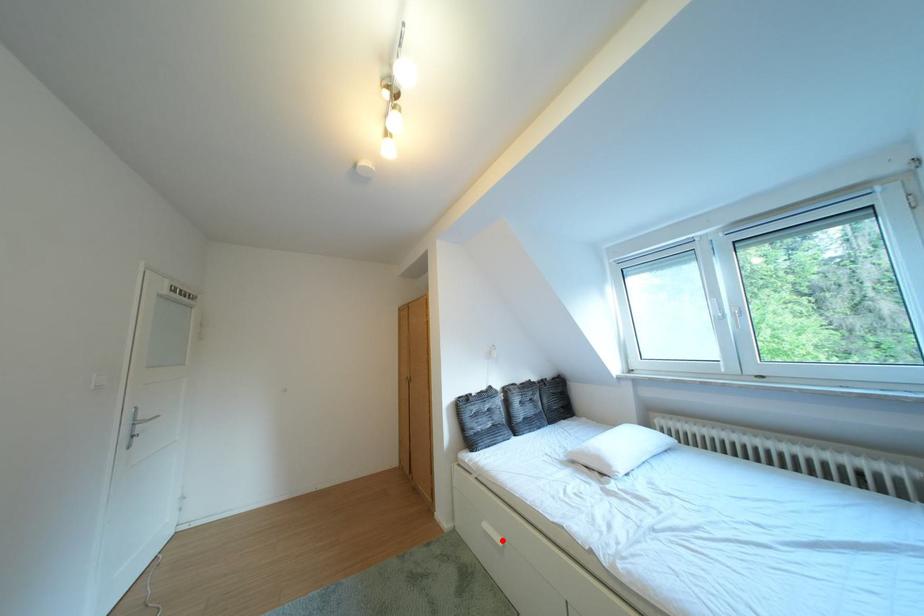
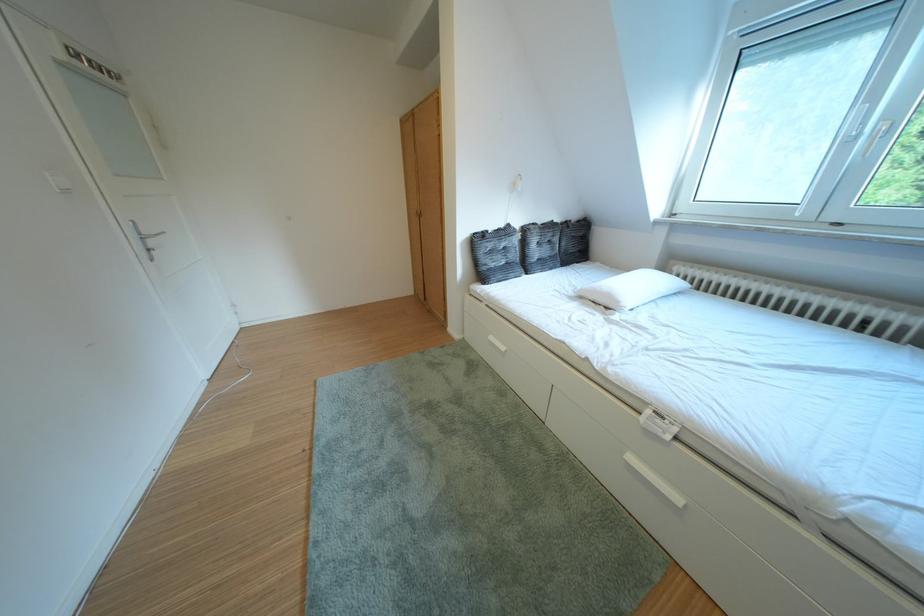
Question: A red point is marked in image1. In image2, is the corresponding 3D point closer to the camera or farther? Reply with the corresponding letter.

Choices:
 (A) The corresponding 3D point is closer.
 (B) The corresponding 3D point is farther.

Answer: (A)